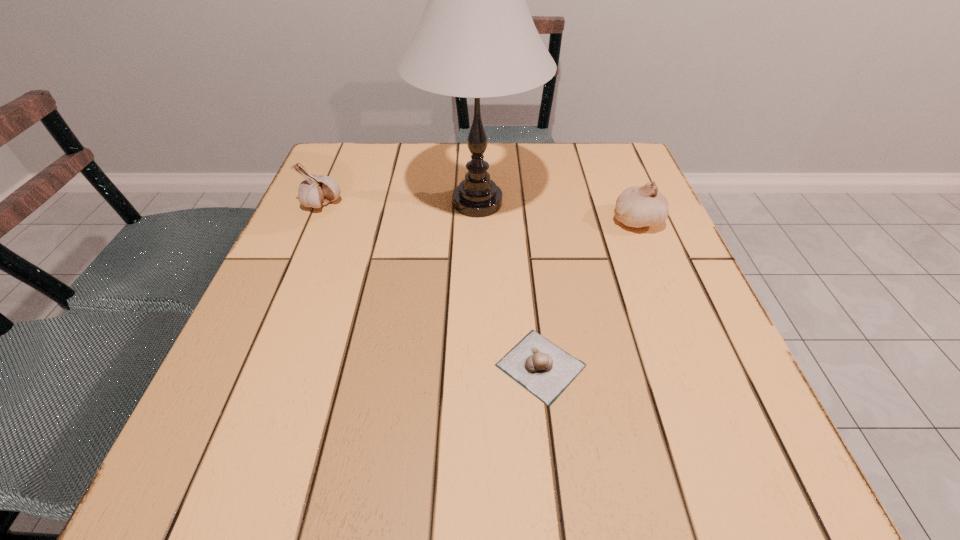
Find the location of a particular element. The width and height of the screenshot is (960, 540). garlic that is at the far edge is located at coordinates (317, 190).

Find the location of a particular element. This screenshot has width=960, height=540. object positioned at the left edge is located at coordinates (317, 190).

Image resolution: width=960 pixels, height=540 pixels. Find the location of `object situated at the right edge`. object situated at the right edge is located at coordinates (638, 206).

The height and width of the screenshot is (540, 960). Identify the location of object present at the far left corner. (317, 190).

Identify the location of vacant space at the far edge of the desktop. This screenshot has width=960, height=540. (394, 172).

You are a GUI agent. You are given a task and a screenshot of the screen. Output one action in this format:
    pyautogui.click(x=<x>, y=<y>)
    Task: Click on the vacant space at the near edge of the desktop
    
    Given the screenshot: What is the action you would take?
    pyautogui.click(x=494, y=444)

Identify the location of free spot at the left edge of the desktop. (276, 418).

At what (x,y) coordinates should I click in order to perform the action: click on vacant point at the right edge. Please return your answer as a coordinate pair (x, y). Looking at the image, I should click on (633, 261).

Where is `free location at the far left corner`? free location at the far left corner is located at coordinates (343, 165).

The width and height of the screenshot is (960, 540). What are the coordinates of `free space at the far right corner of the desktop` in the screenshot? It's located at (576, 168).